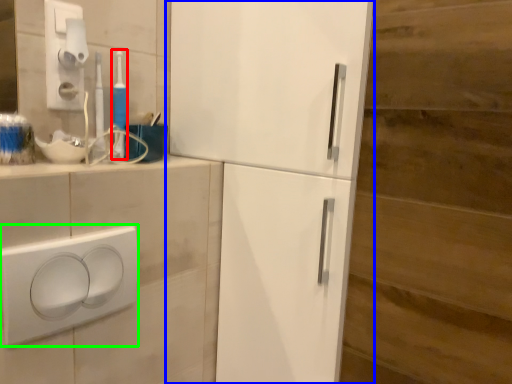
Question: Which is nearer to the toothbrush (highlighted by a red box)? refrigerator (highlighted by a blue box) or light switch (highlighted by a green box).

Choices:
 (A) refrigerator
 (B) light switch

Answer: (B)